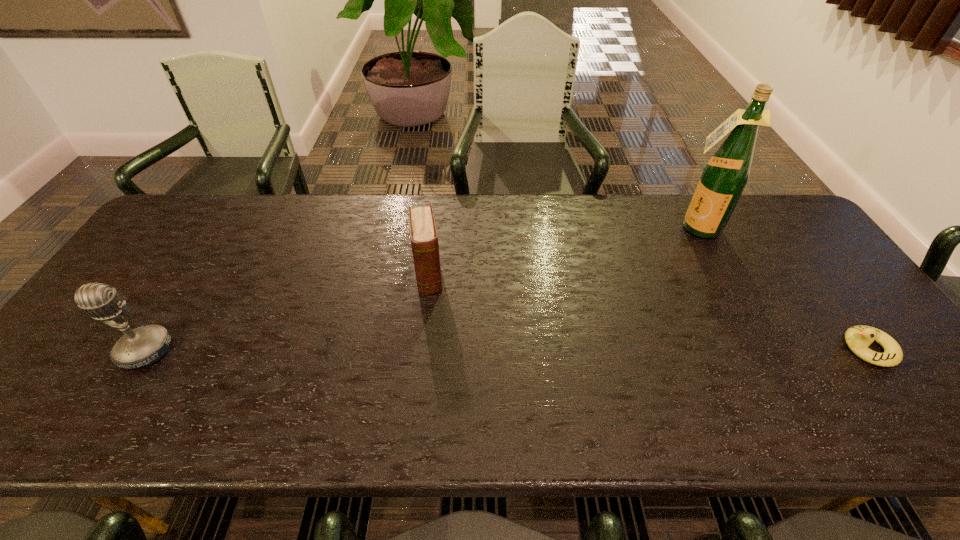
Where is `vacant spot on the desktop that is between the microphone and the shortest object and is positioned on the front-facing side of the third object from left to right`? vacant spot on the desktop that is between the microphone and the shortest object and is positioned on the front-facing side of the third object from left to right is located at coordinates (592, 349).

You are a GUI agent. You are given a task and a screenshot of the screen. Output one action in this format:
    pyautogui.click(x=<x>, y=<y>)
    Task: Click on the free spot on the desktop that is between the third shortest object and the shortest object and is positioned on the spine side of the third nearest object
    The width and height of the screenshot is (960, 540).
    Given the screenshot: What is the action you would take?
    pyautogui.click(x=438, y=350)